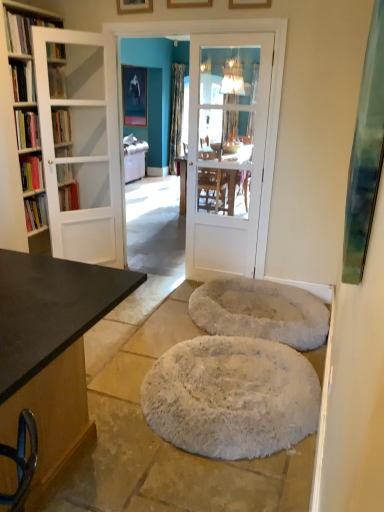
Question: Is wooden picture frame at upper center, the second picture frame from the bottom, shorter than matte white bookshelf at upper left, the second book viewed from the top?

Choices:
 (A) no
 (B) yes

Answer: (A)

Question: Does wooden picture frame at upper center, which is the 3th picture frame in top-to-bottom order, have a greater height compared to matte white bookshelf at upper left, the second book viewed from the top?

Choices:
 (A) no
 (B) yes

Answer: (B)

Question: Is wooden picture frame at upper center, which is the 3th picture frame in top-to-bottom order, facing away from matte white bookshelf at upper left, the second book viewed from the top?

Choices:
 (A) no
 (B) yes

Answer: (A)

Question: Considering the relative positions of wooden picture frame at upper center, the second picture frame in the front-to-back sequence, and matte white bookshelf at upper left, the 3th book positioned from the bottom, in the image provided, is wooden picture frame at upper center, the second picture frame in the front-to-back sequence, to the left of matte white bookshelf at upper left, the 3th book positioned from the bottom, from the viewer's perspective?

Choices:
 (A) yes
 (B) no

Answer: (B)

Question: From the image's perspective, is wooden picture frame at upper center, which ranks as the second picture frame in right-to-left order, on matte white bookshelf at upper left, the second book viewed from the top?

Choices:
 (A) no
 (B) yes

Answer: (B)

Question: Is wooden picture frame at upper center, the third picture frame from the bottom, wider or thinner than hardcover book at upper left, which is the first book from top to bottom?

Choices:
 (A) thin
 (B) wide

Answer: (A)

Question: Would you say wooden picture frame at upper center, the 3th picture frame when ordered from front to back, is inside or outside hardcover book at upper left, arranged as the fourth book when ordered from the bottom?

Choices:
 (A) inside
 (B) outside

Answer: (B)

Question: Visually, is wooden picture frame at upper center, the 3th picture frame when ordered from front to back, positioned to the left or to the right of hardcover book at upper left, arranged as the fourth book when ordered from the bottom?

Choices:
 (A) left
 (B) right

Answer: (B)

Question: Is wooden picture frame at upper center, which is the 3th picture frame from right to left, taller or shorter than hardcover book at upper left, which is the first book from top to bottom?

Choices:
 (A) short
 (B) tall

Answer: (B)

Question: From their relative heights in the image, would you say wooden picture frame at upper center, which appears as the third picture frame when viewed from the left, is taller or shorter than metallic silver picture frame at upper center, which ranks as the first picture frame in left-to-right order?

Choices:
 (A) tall
 (B) short

Answer: (B)

Question: From the image's perspective, is wooden picture frame at upper center, which ranks as the 3th picture frame in back-to-front order, located above or below metallic silver picture frame at upper center, which is the first picture frame in top-to-bottom order?

Choices:
 (A) above
 (B) below

Answer: (B)

Question: Considering their positions, is wooden picture frame at upper center, the second picture frame from the bottom, located in front of or behind metallic silver picture frame at upper center, which is the first picture frame in top-to-bottom order?

Choices:
 (A) behind
 (B) front

Answer: (B)

Question: In terms of width, does wooden picture frame at upper center, which appears as the third picture frame when viewed from the left, look wider or thinner when compared to metallic silver picture frame at upper center, the fourth picture frame ordered from the bottom?

Choices:
 (A) wide
 (B) thin

Answer: (B)

Question: In terms of size, does metallic silver picture frame at upper center, which is counted as the 4th picture frame, starting from the right, appear bigger or smaller than dark brown wood desk at left?

Choices:
 (A) big
 (B) small

Answer: (B)

Question: Is metallic silver picture frame at upper center, positioned as the fourth picture frame in front-to-back order, taller or shorter than dark brown wood desk at left?

Choices:
 (A) short
 (B) tall

Answer: (B)